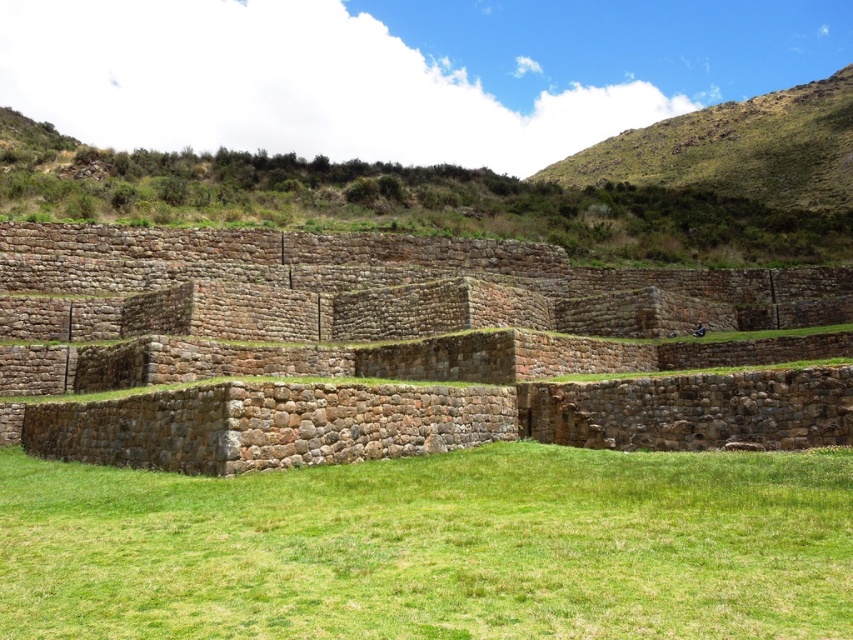
Which is in front, point (790, 269) or point (86, 515)?

Point (86, 515) is in front.

Is brown stone amphitheater at center closer to camera compared to green grass at center?

No, it is behind green grass at center.

Where is `brown stone amphitheater at center`? brown stone amphitheater at center is located at coordinates (395, 348).

Is green grass at center closer to the viewer compared to green grassy hillside at upper right?

Yes.

Does point (773, 468) lie behind point (839, 179)?

No, (773, 468) is closer to viewer.

Is point (403, 627) more distant than point (723, 154)?

No, it is not.

I want to click on green grass at center, so click(x=434, y=547).

Is brown stone wall at upper center closer to the viewer compared to green grassy hillside at upper right?

Yes.

Is point (610, 202) positioned in front of point (664, 152)?

That is True.

Identify the location of brown stone wall at upper center. (439, 196).